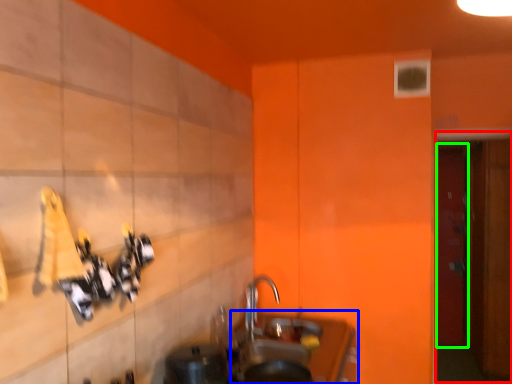
Question: Based on their relative distances, which object is nearer to door (highlighted by a red box)? Choose from counter top (highlighted by a blue box) and door (highlighted by a green box).

Choices:
 (A) counter top
 (B) door

Answer: (A)